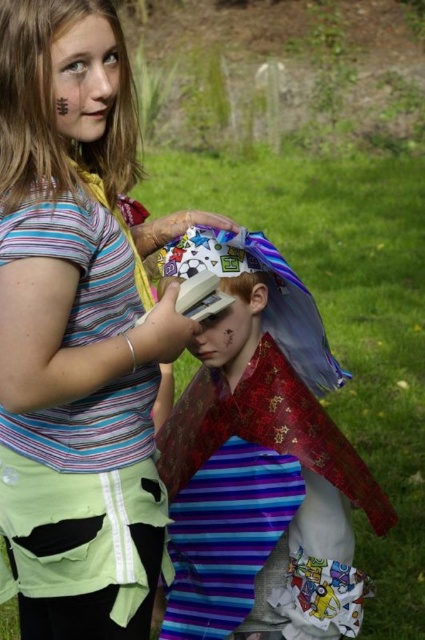
Question: Is striped fabric dress at center closer to the viewer compared to shiny metallic helmet at center?

Choices:
 (A) yes
 (B) no

Answer: (A)

Question: In this image, where is striped fabric dress at center located relative to shiny metallic helmet at center?

Choices:
 (A) left
 (B) right

Answer: (A)

Question: Which point is closer to the camera?

Choices:
 (A) shiny metallic helmet at center
 (B) striped fabric dress at center

Answer: (B)

Question: Is striped fabric dress at center wider than shiny metallic helmet at center?

Choices:
 (A) no
 (B) yes

Answer: (A)